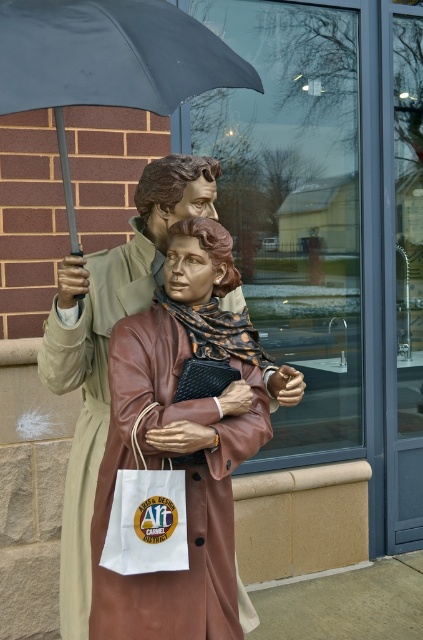
Question: Is matte brown leather coat at center closer to the viewer compared to matte black umbrella at upper center?

Choices:
 (A) no
 (B) yes

Answer: (A)

Question: Is matte brown leather coat at center positioned in front of matte black umbrella at upper center?

Choices:
 (A) no
 (B) yes

Answer: (A)

Question: Among these objects, which one is farthest from the camera?

Choices:
 (A) matte brown leather coat at center
 (B) matte black umbrella at upper center

Answer: (A)

Question: Does matte brown leather coat at center appear on the right side of matte black umbrella at upper center?

Choices:
 (A) no
 (B) yes

Answer: (A)